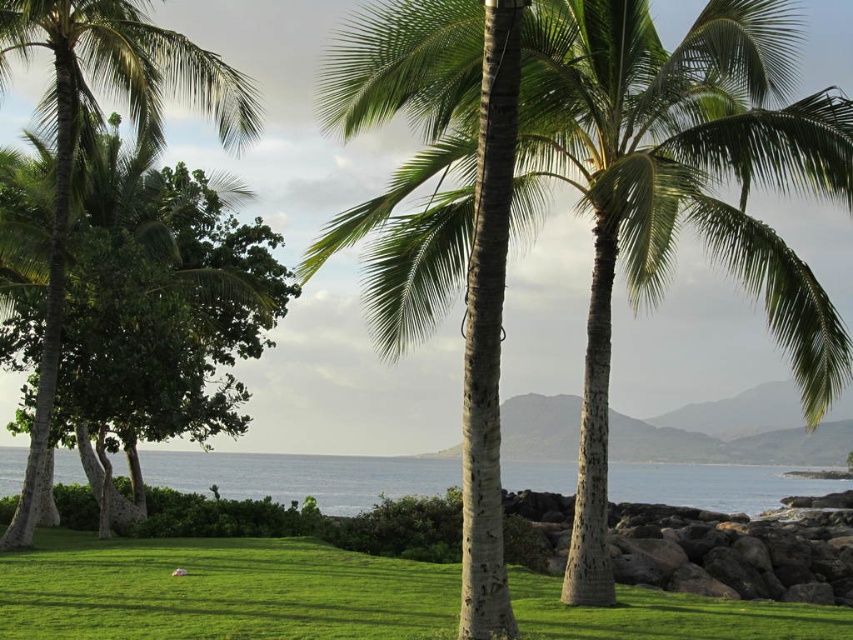
You are standing on the grassy area in front of the two palm trees. If you want to walk to the blue water at center, which direction should you walk relative to the green leafy palm tree at left?

You should walk towards the blue water at center, which is located behind the green leafy palm tree at left. Since the green leafy palm tree at left is positioned over blue water at center, walking towards the direction where the tree is leaning might lead you toward the water.

You are a gardener planning to mow the green grass at center and trim the green leafy palm tree at left. Based on their width, which one requires a larger mower or trimmer attachment?

The green grass at center might be wider than the green leafy palm tree at left, so the mower attachment needs to be larger to accommodate its width.

You are a gardener who wants to plant a new flower bed between the green leafy coconut trees at center and the green grass at center. Considering their heights, which object should you place the flower bed closer to?

The flower bed should be placed closer to the green grass at center because the green leafy coconut trees at center is taller and might cast more shade over the flower bed, potentially affecting the plants.